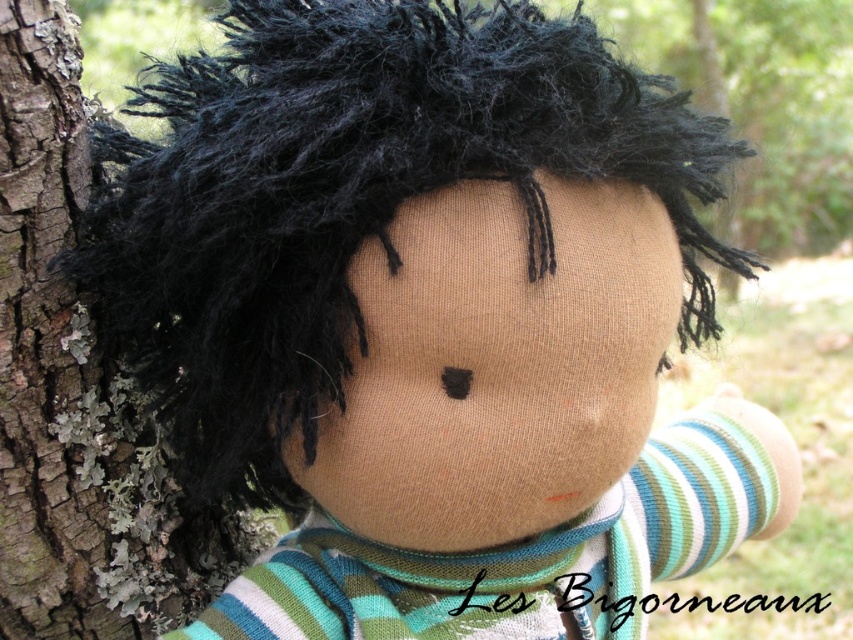
Does black fuzzy hair at center appear on the left side of rough bark tree trunk at left?

No, black fuzzy hair at center is not to the left of rough bark tree trunk at left.

Does black fuzzy hair at center have a lesser height compared to rough bark tree trunk at left?

Yes.

Where is `black fuzzy hair at center`? The width and height of the screenshot is (853, 640). black fuzzy hair at center is located at coordinates (350, 198).